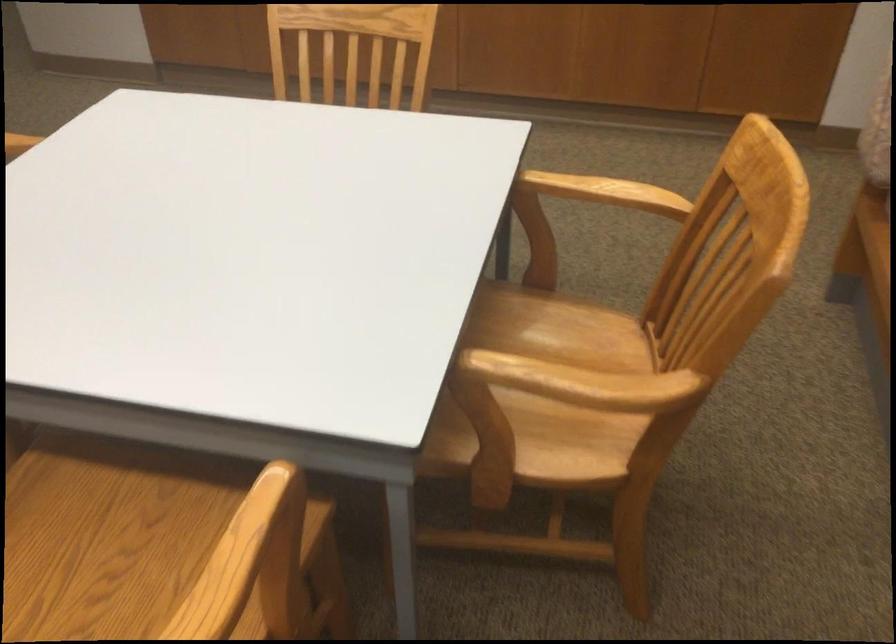
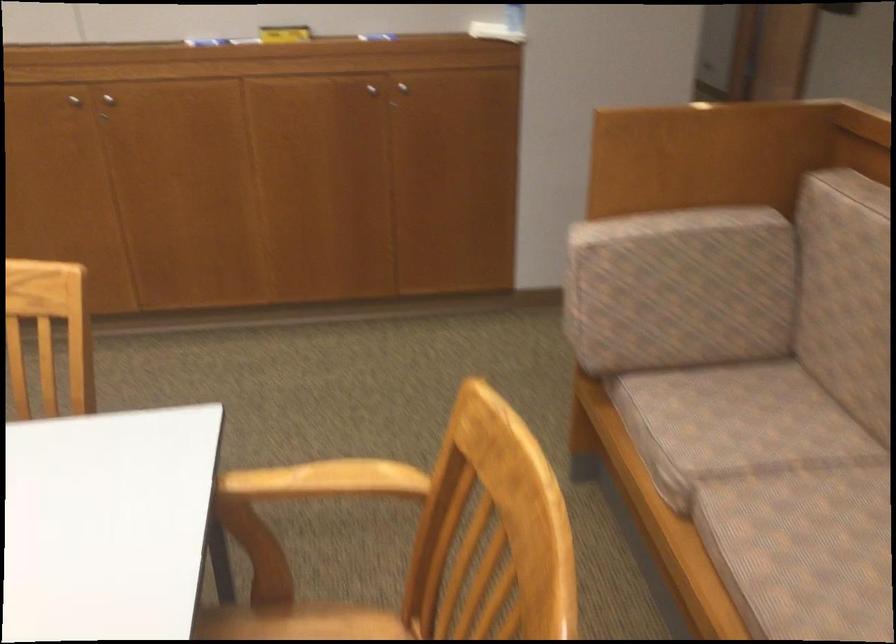
Question: The camera is either moving clockwise (left) or counter-clockwise (right) around the object. The first image is from the beginning of the video and the second image is from the end. Is the camera moving left or right when shooting the video?

Choices:
 (A) Left
 (B) Right

Answer: (A)